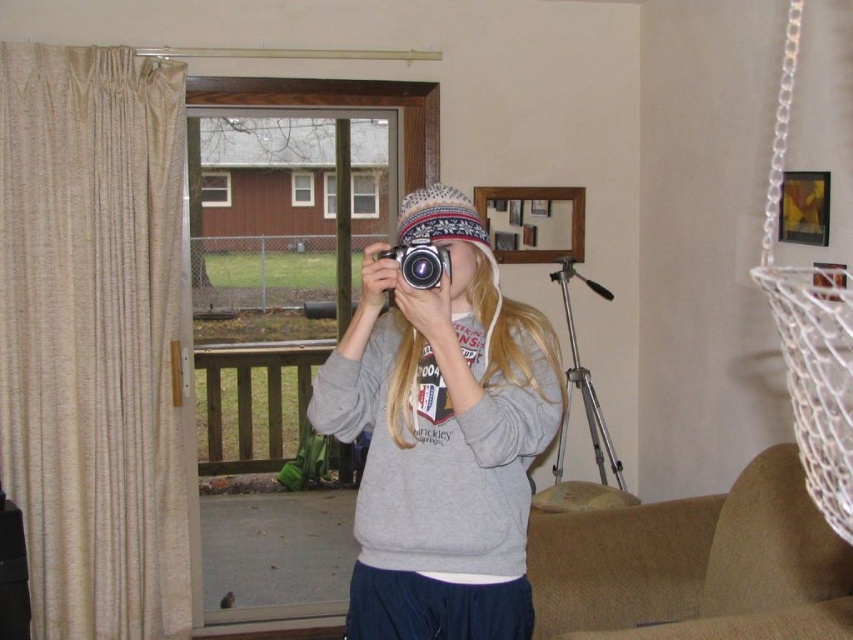
Question: Which is nearer to the gray fleece sweatshirt at center?

Choices:
 (A) silver metallic camera at center
 (B) silver metallic tripod at right

Answer: (A)

Question: Can you confirm if silver metallic tripod at right is positioned to the right of silver metallic camera at center?

Choices:
 (A) yes
 (B) no

Answer: (A)

Question: Does white mesh swing at upper right appear on the left side of silver metallic camera at center?

Choices:
 (A) yes
 (B) no

Answer: (B)

Question: Which point is closer to the camera?

Choices:
 (A) gray fleece sweatshirt at center
 (B) silver metallic tripod at right
 (C) white mesh swing at upper right

Answer: (A)

Question: Is white mesh swing at upper right positioned behind silver metallic camera at center?

Choices:
 (A) yes
 (B) no

Answer: (A)

Question: Which point is closer to the camera taking this photo?

Choices:
 (A) (573, 369)
 (B) (786, 340)

Answer: (B)